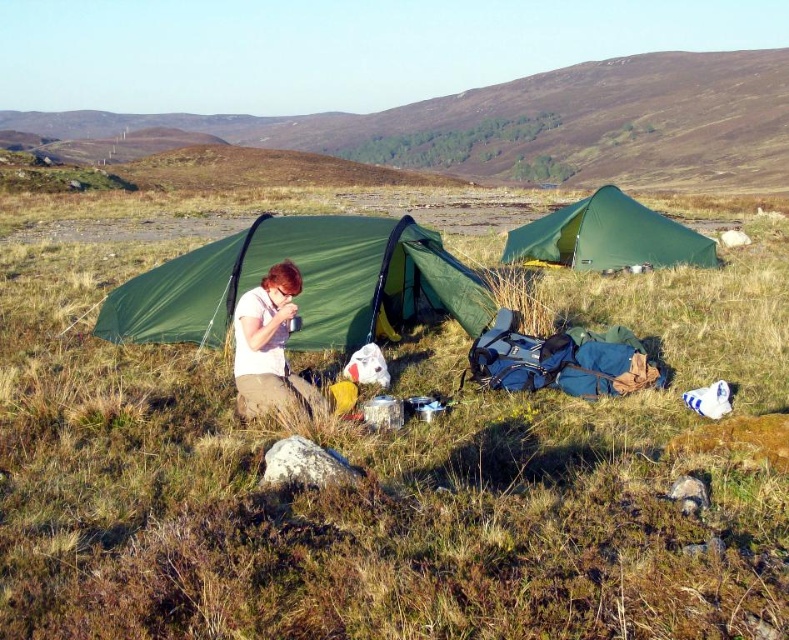
You are a hiker who just arrived at the campsite and want to grab your mug before setting up your tent. Which object should you approach first, the green canvas tent at center or the matte white mug at center?

You should approach the green canvas tent at center first because the matte white mug at center is behind it, so you need to go around or move the tent to access the mug.